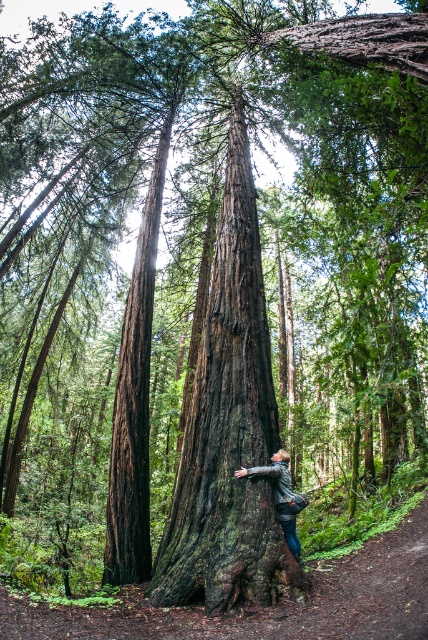
Question: Can you confirm if dark brown rough bark at center is positioned to the left of leather jacket at center?

Choices:
 (A) no
 (B) yes

Answer: (B)

Question: Based on their relative distances, which object is nearer to the dark brown bark tree trunk at center?

Choices:
 (A) leather jacket at center
 (B) dark brown rough bark at center

Answer: (A)

Question: Is dark brown bark tree trunk at center smaller than leather jacket at center?

Choices:
 (A) yes
 (B) no

Answer: (A)

Question: Estimate the real-world distances between objects in this image. Which object is farther from the leather jacket at center?

Choices:
 (A) dark brown rough bark at center
 (B) dark brown bark tree trunk at center

Answer: (B)

Question: Which point is closer to the camera?

Choices:
 (A) (216, 525)
 (B) (249, 472)
 (C) (151, 561)

Answer: (A)

Question: Is dark brown bark tree trunk at center bigger than leather jacket at center?

Choices:
 (A) yes
 (B) no

Answer: (B)